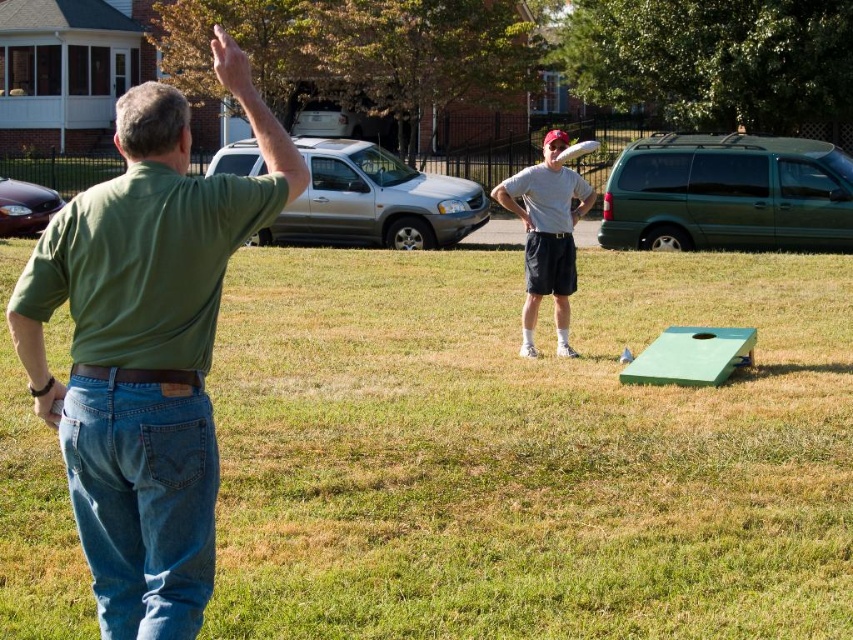
Can you confirm if light gray t-shirt at center is smaller than white matte frisbee at center?

Yes, light gray t-shirt at center is smaller than white matte frisbee at center.

Between point (527, 273) and point (556, 157), which one is positioned in front?

Point (556, 157) is more forward.

The image size is (853, 640). I want to click on light gray t-shirt at center, so click(547, 236).

Is green matte shirt at left positioned in front of white matte frisbee at center?

Yes.

Which is below, green matte shirt at left or white matte frisbee at center?

green matte shirt at left

Locate an element on the screen. green matte shirt at left is located at coordinates (148, 348).

Can you confirm if green matte board at center is positioned to the left of light gray t-shirt at center?

Correct, you'll find green matte board at center to the left of light gray t-shirt at center.

Is the position of green matte board at center less distant than that of light gray t-shirt at center?

Yes, green matte board at center is in front of light gray t-shirt at center.

Is point (614, 609) less distant than point (520, 349)?

Yes, point (614, 609) is in front of point (520, 349).

Where is `green matte board at center`? This screenshot has height=640, width=853. green matte board at center is located at coordinates (527, 451).